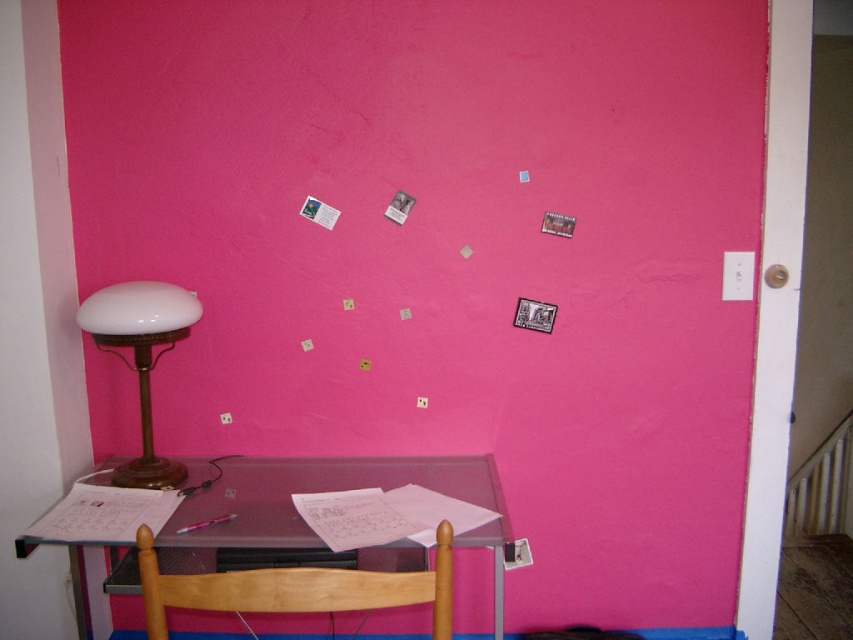
Does wooden chair at lower center appear under white opaline glass lampshade at left?

Yes.

Between wooden chair at lower center and white opaline glass lampshade at left, which one has more height?

Standing taller between the two is white opaline glass lampshade at left.

The width and height of the screenshot is (853, 640). Find the location of `wooden chair at lower center`. wooden chair at lower center is located at coordinates (294, 588).

Identify the location of wooden chair at lower center. This screenshot has width=853, height=640. (294, 588).

Between transparent glass table at lower left and wooden chair at lower center, which one is positioned higher?

wooden chair at lower center is above.

Who is positioned more to the left, transparent glass table at lower left or wooden chair at lower center?

From the viewer's perspective, transparent glass table at lower left appears more on the left side.

Locate an element on the screen. transparent glass table at lower left is located at coordinates 329,490.

Can you confirm if transparent glass table at lower left is taller than white opaline glass lampshade at left?

No, transparent glass table at lower left is not taller than white opaline glass lampshade at left.

Does transparent glass table at lower left have a larger size compared to white opaline glass lampshade at left?

Yes, transparent glass table at lower left is bigger than white opaline glass lampshade at left.

What do you see at coordinates (329, 490) in the screenshot? I see `transparent glass table at lower left` at bounding box center [329, 490].

Locate an element on the screen. The image size is (853, 640). transparent glass table at lower left is located at coordinates (329, 490).